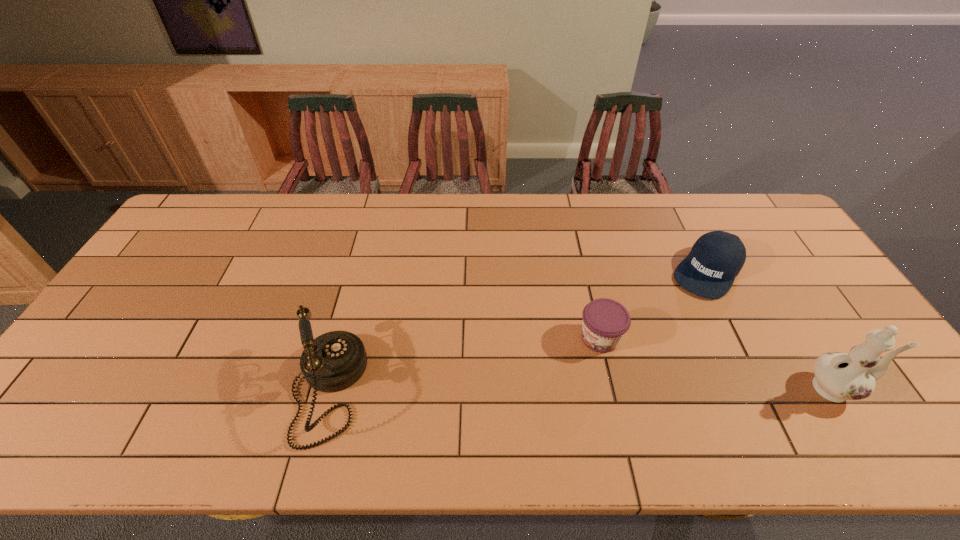
At what (x,y) coordinates should I click in order to perform the action: click on vacant area that lies between the third object from right to left and the farthest object. Please return your answer as a coordinate pair (x, y). The width and height of the screenshot is (960, 540). Looking at the image, I should click on (654, 305).

At what (x,y) coordinates should I click in order to perform the action: click on the closest object relative to the third object from right to left. Please return your answer as a coordinate pair (x, y). Looking at the image, I should click on (716, 258).

You are a GUI agent. You are given a task and a screenshot of the screen. Output one action in this format:
    pyautogui.click(x=<x>, y=<y>)
    Task: Click on the object that is the closest one to the second object from left to right
    Image resolution: width=960 pixels, height=540 pixels.
    Given the screenshot: What is the action you would take?
    pyautogui.click(x=716, y=258)

Where is `vacant space that satisfies the following two spatial constraints: 1. on the back side of the third shortest object; 2. on the right side of the baseball cap`? vacant space that satisfies the following two spatial constraints: 1. on the back side of the third shortest object; 2. on the right side of the baseball cap is located at coordinates (359, 272).

The height and width of the screenshot is (540, 960). In order to click on blank area in the image that satisfies the following two spatial constraints: 1. on the front side of the chinaware; 2. at the spout of the jam in this screenshot , I will do `click(612, 388)`.